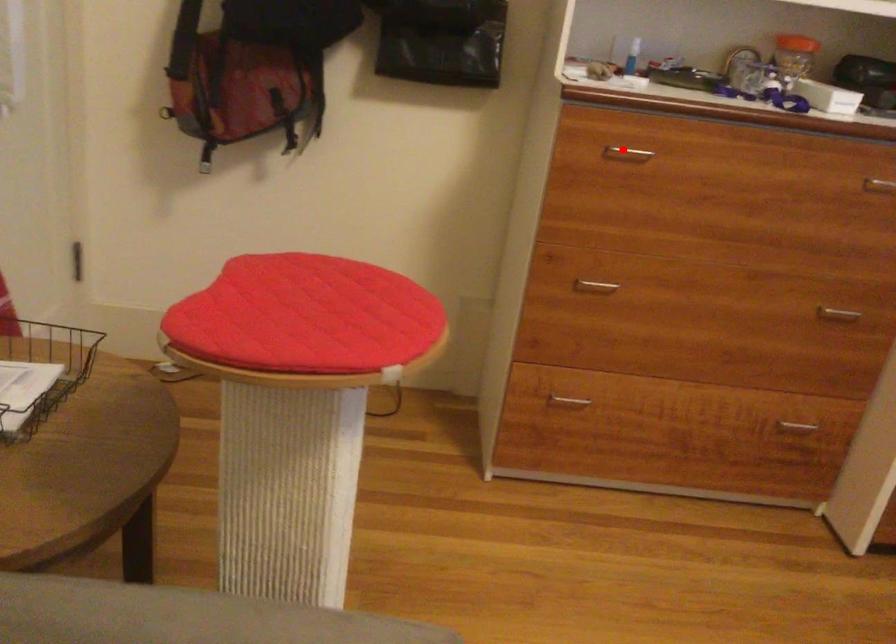
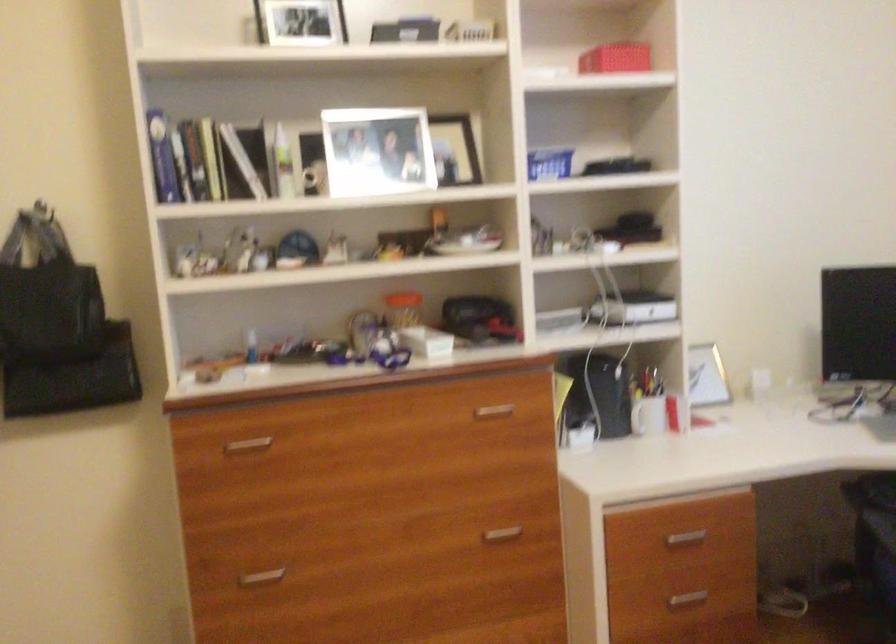
Locate, in the second image, the point that corresponds to the highlighted location in the first image.

(247, 444)